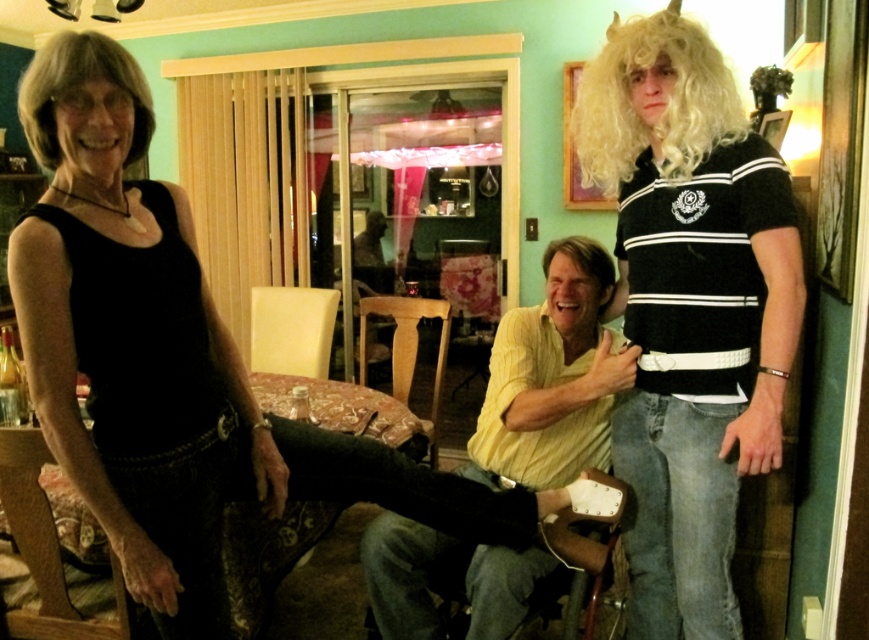
Is blonde synthetic wig at upper right bigger than blonde synthetic wig at center?

Yes.

Between blonde synthetic wig at upper right and blonde synthetic wig at center, which one is positioned higher?

Positioned higher is blonde synthetic wig at upper right.

Locate an element on the screen. Image resolution: width=869 pixels, height=640 pixels. blonde synthetic wig at upper right is located at coordinates (665, 102).

Identify the location of blonde synthetic wig at upper right. Image resolution: width=869 pixels, height=640 pixels. (665, 102).

Does point (214, 529) come closer to viewer compared to point (700, 150)?

Yes, point (214, 529) is in front of point (700, 150).

Who is higher up, black matte tank top at left or blonde synthetic wig at upper right?

Positioned higher is blonde synthetic wig at upper right.

You are a GUI agent. You are given a task and a screenshot of the screen. Output one action in this format:
    pyautogui.click(x=<x>, y=<y>)
    Task: Click on the black matte tank top at left
    This screenshot has width=869, height=640.
    Given the screenshot: What is the action you would take?
    pyautogui.click(x=129, y=337)

This screenshot has height=640, width=869. I want to click on black matte tank top at left, so click(129, 337).

Which is more to the left, black matte tank top at left or white curly wig at upper left?

From the viewer's perspective, white curly wig at upper left appears more on the left side.

Who is shorter, black matte tank top at left or white curly wig at upper left?

white curly wig at upper left is shorter.

Is point (54, 374) behind point (131, 58)?

No, it is in front of (131, 58).

The height and width of the screenshot is (640, 869). I want to click on black matte tank top at left, so click(x=129, y=337).